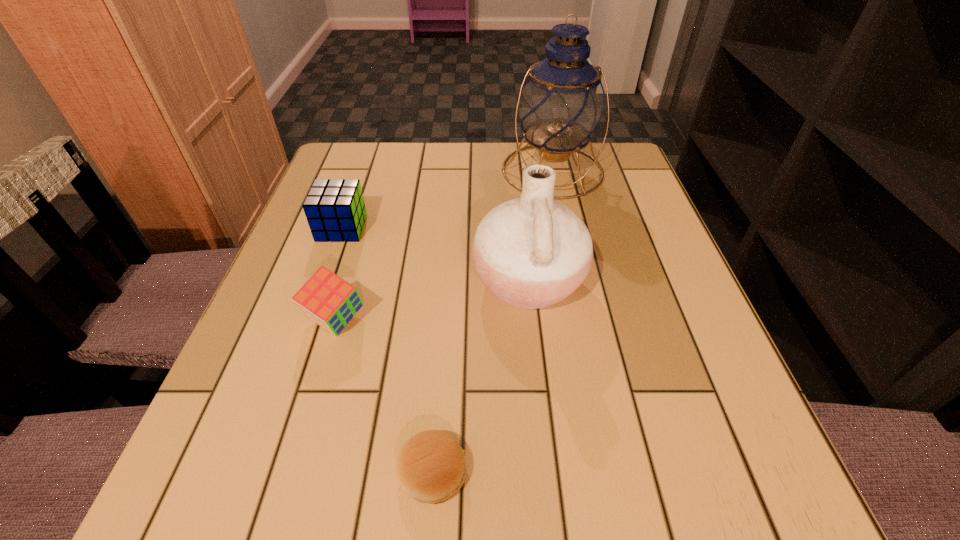
You are a GUI agent. You are given a task and a screenshot of the screen. Output one action in this format:
    pyautogui.click(x=<x>, y=<y>)
    Task: Click on the free area in between the nearer cube and the farthest object
    The height and width of the screenshot is (540, 960).
    Given the screenshot: What is the action you would take?
    pyautogui.click(x=444, y=246)

This screenshot has width=960, height=540. Identify the location of free space that is in between the farthest object and the farther cube. (447, 199).

Locate an element on the screen. Image resolution: width=960 pixels, height=540 pixels. vacant area that lies between the tallest object and the nearer cube is located at coordinates coord(444,246).

Locate which object ranks fourth in proximity to the shortest object. Please provide its 2D coordinates. Your answer should be formatted as a tuple, i.e. [(x, y)], where the tuple contains the x and y coordinates of a point satisfying the conditions above.

[(561, 104)]

Where is `object that is the fourth closest to the shortest object`? This screenshot has height=540, width=960. object that is the fourth closest to the shortest object is located at coordinates (561, 104).

Identify the location of blank space that satisfies the following two spatial constraints: 1. on the front side of the nearest object; 2. on the left side of the fourth nearest object. (256, 471).

Where is `free location that satisfies the following two spatial constraints: 1. on the front-facing side of the tallest object; 2. to pour from the handle of the second tallest object`? Image resolution: width=960 pixels, height=540 pixels. free location that satisfies the following two spatial constraints: 1. on the front-facing side of the tallest object; 2. to pour from the handle of the second tallest object is located at coordinates (576, 281).